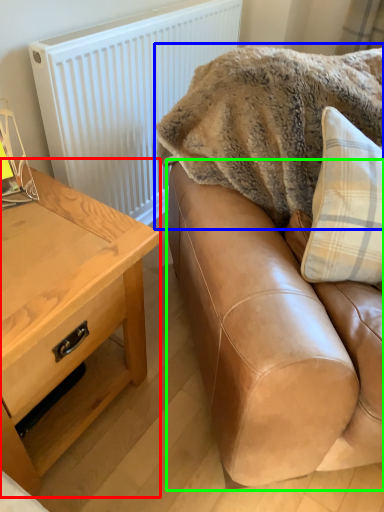
Question: Which object is the closest to the table (highlighted by a red box)? Choose among these: blanket (highlighted by a blue box) or studio couch (highlighted by a green box).

Choices:
 (A) blanket
 (B) studio couch

Answer: (B)